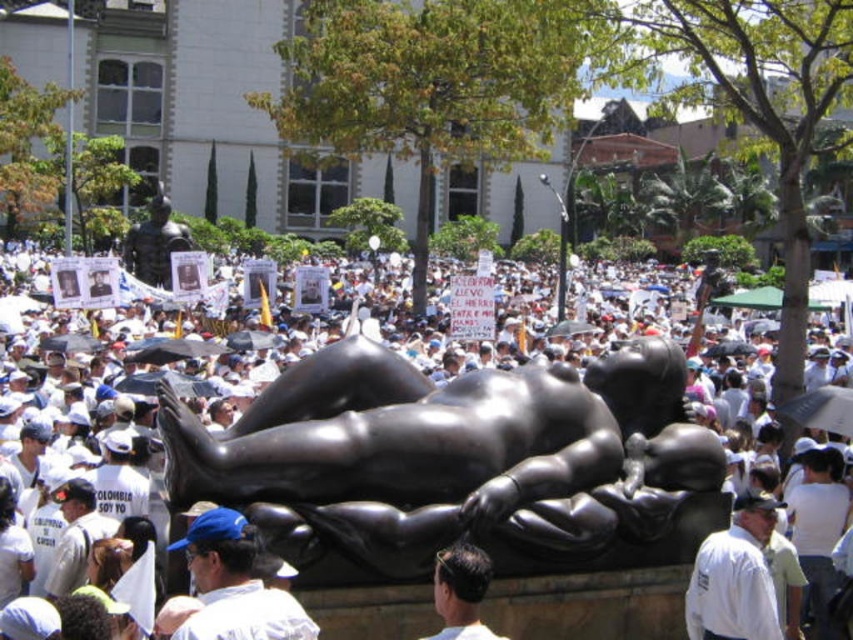
Does white matte crowd at center have a larger size compared to dark brown hair at center?

Yes.

In the scene shown: Is white matte crowd at center taller than dark brown hair at center?

Correct, white matte crowd at center is much taller as dark brown hair at center.

Is point (624, 368) positioned behind point (476, 582)?

Yes, point (624, 368) is farther from viewer.

The width and height of the screenshot is (853, 640). Find the location of `white matte crowd at center`. white matte crowd at center is located at coordinates (438, 468).

Does white matte crowd at center have a smaller size compared to white matte shirt at center?

Actually, white matte crowd at center might be larger than white matte shirt at center.

Is point (650, 522) positioned behind point (759, 497)?

Yes, point (650, 522) is farther from viewer.

What do you see at coordinates (438, 468) in the screenshot?
I see `white matte crowd at center` at bounding box center [438, 468].

Where is `white matte crowd at center`? white matte crowd at center is located at coordinates (438, 468).

Is white matte crowd at center further to the viewer compared to black polished statue at center?

No, it is not.

Is white matte crowd at center below black polished statue at center?

No.

Between point (349, 593) and point (508, 381), which one is positioned behind?

The point (508, 381) is more distant.

At what (x,y) coordinates should I click in order to perform the action: click on white matte crowd at center. Please return your answer as a coordinate pair (x, y). Looking at the image, I should click on (438, 468).